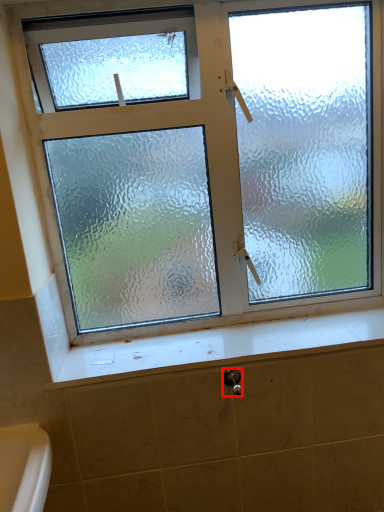
Question: Considering the relative positions of shower (annotated by the red box) and window sill in the image provided, where is shower (annotated by the red box) located with respect to the staircase?

Choices:
 (A) right
 (B) left

Answer: (B)